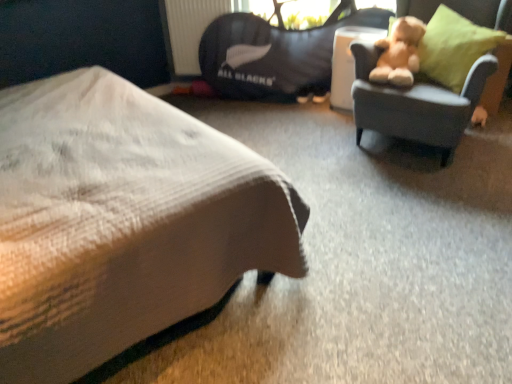
Question: Can you see black fabric bean bag at upper center touching white textured bed at lower left?

Choices:
 (A) no
 (B) yes

Answer: (A)

Question: Considering the relative sizes of black fabric bean bag at upper center and white textured bed at lower left in the image provided, is black fabric bean bag at upper center smaller than white textured bed at lower left?

Choices:
 (A) yes
 (B) no

Answer: (A)

Question: Is white textured bed at lower left at the back of black fabric bean bag at upper center?

Choices:
 (A) yes
 (B) no

Answer: (B)

Question: Is black fabric bean bag at upper center bigger than white textured bed at lower left?

Choices:
 (A) no
 (B) yes

Answer: (A)

Question: Does black fabric bean bag at upper center have a greater height compared to white textured bed at lower left?

Choices:
 (A) no
 (B) yes

Answer: (A)

Question: Considering the relative sizes of black fabric bean bag at upper center and white textured bed at lower left in the image provided, is black fabric bean bag at upper center wider than white textured bed at lower left?

Choices:
 (A) yes
 (B) no

Answer: (B)

Question: Is black fabric bean bag at upper center completely or partially inside soft gray fabric chair at upper right?

Choices:
 (A) yes
 (B) no

Answer: (B)

Question: Considering the relative sizes of soft gray fabric chair at upper right and black fabric bean bag at upper center in the image provided, is soft gray fabric chair at upper right thinner than black fabric bean bag at upper center?

Choices:
 (A) no
 (B) yes

Answer: (A)

Question: From a real-world perspective, is soft gray fabric chair at upper right below black fabric bean bag at upper center?

Choices:
 (A) no
 (B) yes

Answer: (A)

Question: Does soft gray fabric chair at upper right have a greater height compared to black fabric bean bag at upper center?

Choices:
 (A) yes
 (B) no

Answer: (A)

Question: Is the position of soft gray fabric chair at upper right less distant than that of black fabric bean bag at upper center?

Choices:
 (A) no
 (B) yes

Answer: (B)

Question: Considering the relative sizes of soft gray fabric chair at upper right and black fabric bean bag at upper center in the image provided, is soft gray fabric chair at upper right bigger than black fabric bean bag at upper center?

Choices:
 (A) no
 (B) yes

Answer: (B)

Question: From the image's perspective, does green fabric pillow at right appear lower than white textured bed at lower left?

Choices:
 (A) no
 (B) yes

Answer: (A)